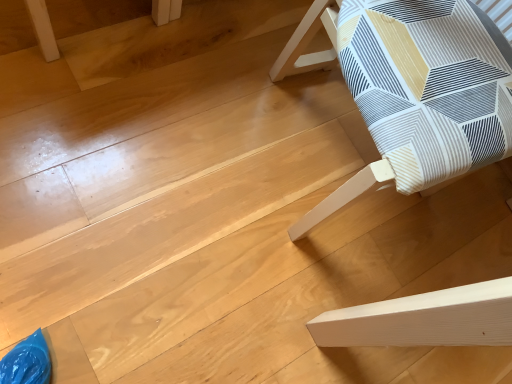
The width and height of the screenshot is (512, 384). Find the location of `white fabric chair at right, placed as the first furniture when sorted from right to left`. white fabric chair at right, placed as the first furniture when sorted from right to left is located at coordinates 414,90.

Describe the element at coordinates (414, 90) in the screenshot. This screenshot has height=384, width=512. I see `white fabric chair at right, placed as the first furniture when sorted from right to left` at that location.

What are the coordinates of `light brown wood table at upper left, the 1th furniture from the left` in the screenshot? It's located at (42, 29).

The height and width of the screenshot is (384, 512). What do you see at coordinates (42, 29) in the screenshot? I see `light brown wood table at upper left, which appears as the second furniture when viewed from the right` at bounding box center [42, 29].

The width and height of the screenshot is (512, 384). What are the coordinates of `white fabric chair at right, which is the second furniture in left-to-right order` in the screenshot? It's located at (414, 90).

Considering the relative positions of white fabric chair at right, placed as the first furniture when sorted from right to left, and light brown wood table at upper left, which appears as the second furniture when viewed from the right, in the image provided, is white fabric chair at right, placed as the first furniture when sorted from right to left, to the right of light brown wood table at upper left, which appears as the second furniture when viewed from the right, from the viewer's perspective?

Yes.

Between white fabric chair at right, placed as the first furniture when sorted from right to left, and light brown wood table at upper left, the 1th furniture from the left, which one is positioned in front?

Positioned in front is white fabric chair at right, placed as the first furniture when sorted from right to left.

Which is less distant, (379, 134) or (51, 43)?

The point (379, 134) is closer to the camera.

From the image's perspective, which object appears higher, white fabric chair at right, which is the second furniture in left-to-right order, or light brown wood table at upper left, which appears as the second furniture when viewed from the right?

light brown wood table at upper left, which appears as the second furniture when viewed from the right, is shown above in the image.

From a real-world perspective, which object rests below the other?

light brown wood table at upper left, the 1th furniture from the left, from a real-world perspective.

In terms of width, does white fabric chair at right, placed as the first furniture when sorted from right to left, look wider or thinner when compared to light brown wood table at upper left, the 1th furniture from the left?

Considering their sizes, white fabric chair at right, placed as the first furniture when sorted from right to left, looks broader than light brown wood table at upper left, the 1th furniture from the left.

Is white fabric chair at right, placed as the first furniture when sorted from right to left, shorter than light brown wood table at upper left, the 1th furniture from the left?

No, white fabric chair at right, placed as the first furniture when sorted from right to left, is not shorter than light brown wood table at upper left, the 1th furniture from the left.

Considering the sizes of objects white fabric chair at right, which is the second furniture in left-to-right order, and light brown wood table at upper left, the 1th furniture from the left, in the image provided, who is smaller, white fabric chair at right, which is the second furniture in left-to-right order, or light brown wood table at upper left, the 1th furniture from the left,?

light brown wood table at upper left, the 1th furniture from the left, is smaller.

Is white fabric chair at right, which is the second furniture in left-to-right order, situated inside light brown wood table at upper left, which appears as the second furniture when viewed from the right, or outside?

The correct answer is: outside.

Looking at this image, does white fabric chair at right, which is the second furniture in left-to-right order, touch light brown wood table at upper left, the 1th furniture from the left?

No, white fabric chair at right, which is the second furniture in left-to-right order, is not in contact with light brown wood table at upper left, the 1th furniture from the left.

Is light brown wood table at upper left, the 1th furniture from the left, at the back of white fabric chair at right, placed as the first furniture when sorted from right to left?

No, white fabric chair at right, placed as the first furniture when sorted from right to left, is not facing away from light brown wood table at upper left, the 1th furniture from the left.

How distant is white fabric chair at right, placed as the first furniture when sorted from right to left, from light brown wood table at upper left, the 1th furniture from the left?

They are 30.27 inches apart.

Locate an element on the screen. furniture positioned vertically above the light brown wood table at upper left, the 1th furniture from the left (from a real-world perspective) is located at coordinates (414, 90).

Does light brown wood table at upper left, which appears as the second furniture when viewed from the right, appear on the right side of white fabric chair at right, placed as the first furniture when sorted from right to left?

In fact, light brown wood table at upper left, which appears as the second furniture when viewed from the right, is to the left of white fabric chair at right, placed as the first furniture when sorted from right to left.

Considering their positions, is light brown wood table at upper left, which appears as the second furniture when viewed from the right, located in front of or behind white fabric chair at right, placed as the first furniture when sorted from right to left?

light brown wood table at upper left, which appears as the second furniture when viewed from the right, is positioned farther from the viewer than white fabric chair at right, placed as the first furniture when sorted from right to left.

Is point (176, 0) closer to viewer compared to point (379, 17)?

That is False.

From the image's perspective, is light brown wood table at upper left, the 1th furniture from the left, positioned above or below white fabric chair at right, placed as the first furniture when sorted from right to left?

light brown wood table at upper left, the 1th furniture from the left, is above white fabric chair at right, placed as the first furniture when sorted from right to left.

From a real-world perspective, which is physically above, light brown wood table at upper left, which appears as the second furniture when viewed from the right, or white fabric chair at right, placed as the first furniture when sorted from right to left?

From a 3D spatial view, white fabric chair at right, placed as the first furniture when sorted from right to left, is above.

Is light brown wood table at upper left, the 1th furniture from the left, wider than white fabric chair at right, which is the second furniture in left-to-right order?

In fact, light brown wood table at upper left, the 1th furniture from the left, might be narrower than white fabric chair at right, which is the second furniture in left-to-right order.

Who is taller, light brown wood table at upper left, the 1th furniture from the left, or white fabric chair at right, which is the second furniture in left-to-right order?

Standing taller between the two is white fabric chair at right, which is the second furniture in left-to-right order.

Considering the relative sizes of light brown wood table at upper left, which appears as the second furniture when viewed from the right, and white fabric chair at right, which is the second furniture in left-to-right order, in the image provided, is light brown wood table at upper left, which appears as the second furniture when viewed from the right, smaller than white fabric chair at right, which is the second furniture in left-to-right order,?

Yes, light brown wood table at upper left, which appears as the second furniture when viewed from the right, is smaller than white fabric chair at right, which is the second furniture in left-to-right order.

Is white fabric chair at right, which is the second furniture in left-to-right order, located within light brown wood table at upper left, which appears as the second furniture when viewed from the right?

Actually, white fabric chair at right, which is the second furniture in left-to-right order, is outside light brown wood table at upper left, which appears as the second furniture when viewed from the right.

Is light brown wood table at upper left, which appears as the second furniture when viewed from the right, with white fabric chair at right, placed as the first furniture when sorted from right to left?

light brown wood table at upper left, which appears as the second furniture when viewed from the right, and white fabric chair at right, placed as the first furniture when sorted from right to left, are not in contact.

Is light brown wood table at upper left, the 1th furniture from the left, aimed at white fabric chair at right, which is the second furniture in left-to-right order?

Yes, light brown wood table at upper left, the 1th furniture from the left, is turned towards white fabric chair at right, which is the second furniture in left-to-right order.

The width and height of the screenshot is (512, 384). In order to click on furniture directly beneath the white fabric chair at right, which is the second furniture in left-to-right order (from a real-world perspective) in this screenshot , I will do `click(42, 29)`.

The width and height of the screenshot is (512, 384). What are the coordinates of `furniture above the light brown wood table at upper left, the 1th furniture from the left (from a real-world perspective)` in the screenshot? It's located at (414, 90).

This screenshot has height=384, width=512. Identify the location of furniture behind the white fabric chair at right, which is the second furniture in left-to-right order. (42, 29).